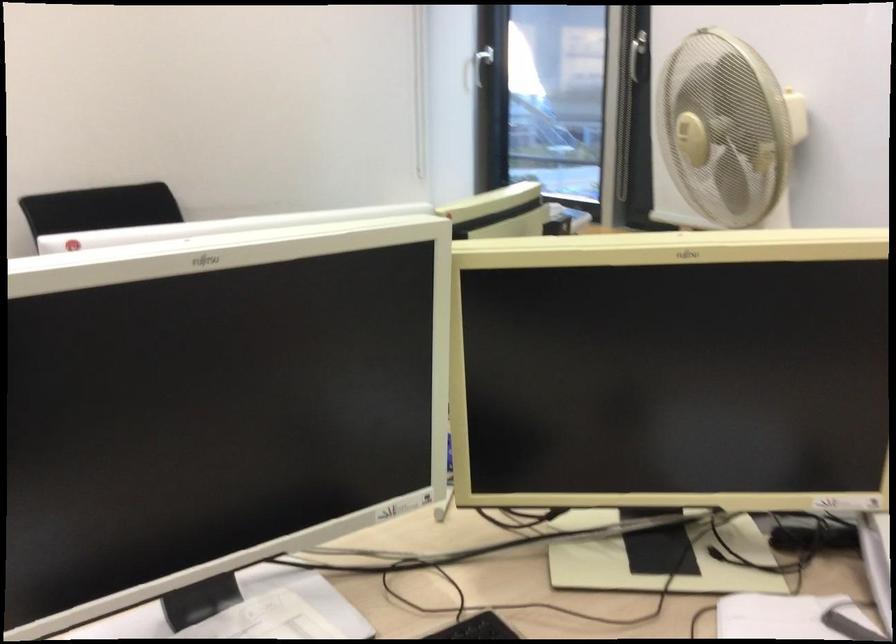
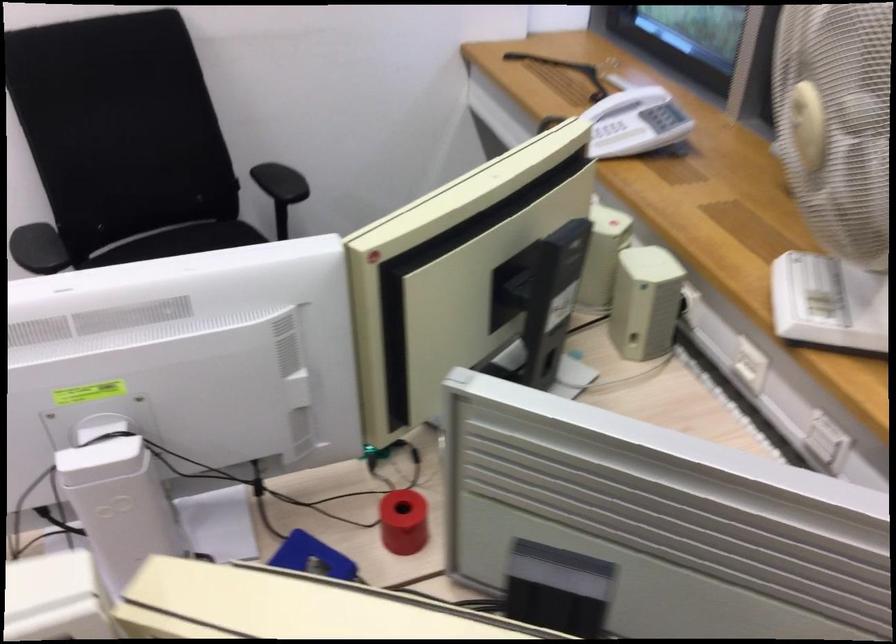
In a continuous first-person perspective shot, in which direction is the camera moving?

The cameraman moved toward right, forward.